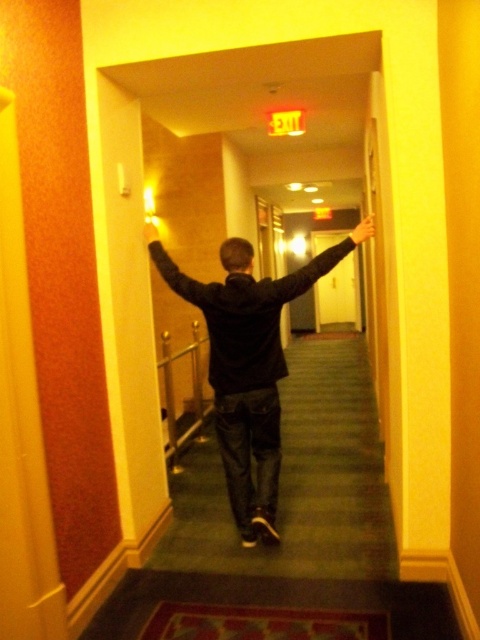
From the picture: Between yellow matte door at center and smooth yellow hand at center, which one has more height?

With more height is yellow matte door at center.

Is point (327, 230) closer to camera compared to point (156, 237)?

No, (327, 230) is behind (156, 237).

I want to click on yellow matte door at center, so click(x=338, y=296).

Describe the element at coordinates (338, 296) in the screenshot. This screenshot has height=640, width=480. I see `yellow matte door at center` at that location.

Can you confirm if yellow matte door at center is shorter than matte black arm at upper center?

No, yellow matte door at center is not shorter than matte black arm at upper center.

What do you see at coordinates (338, 296) in the screenshot?
I see `yellow matte door at center` at bounding box center [338, 296].

Find the location of `yellow matte door at center`. yellow matte door at center is located at coordinates coord(338,296).

Does point (245, 356) lie behind point (346, 301)?

No, it is not.

Is point (167, 284) farther from viewer compared to point (337, 234)?

That is False.

Identify the location of dark gray hoodie at center. (247, 368).